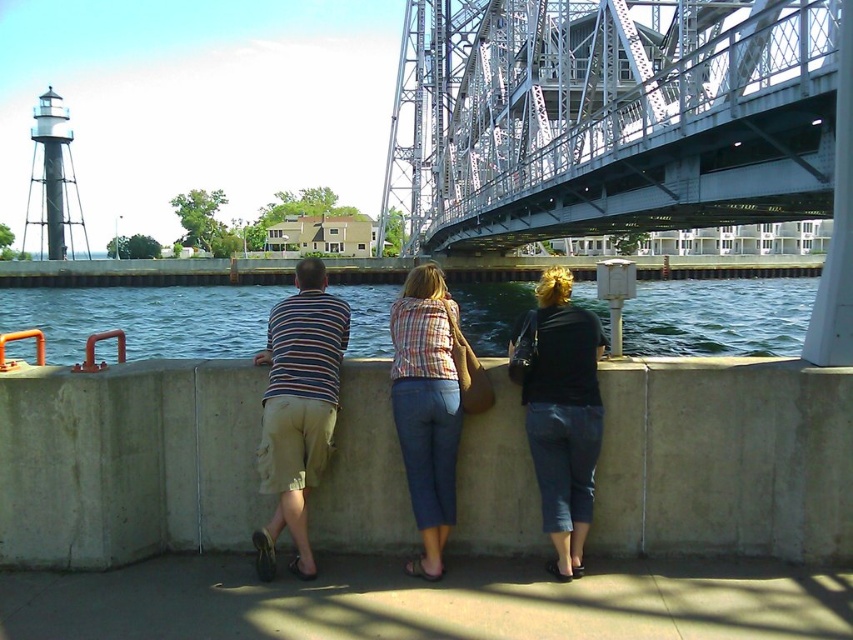
Question: Which point is closer to the camera taking this photo?

Choices:
 (A) (424, 358)
 (B) (560, 496)
 (C) (816, 44)

Answer: (B)

Question: Is black denim jeans at center positioned at the back of plaid shirt at center?

Choices:
 (A) yes
 (B) no

Answer: (B)

Question: Which object is closer to the camera taking this photo?

Choices:
 (A) blue water at center
 (B) plaid shirt at center

Answer: (B)

Question: Is striped cotton shirt at center above striped fabric shorts at center?

Choices:
 (A) no
 (B) yes

Answer: (B)

Question: Does blue water at center have a greater width compared to black denim jeans at center?

Choices:
 (A) yes
 (B) no

Answer: (A)

Question: Which point is farther from the camera taking this photo?

Choices:
 (A) (453, 493)
 (B) (440, 426)
 (C) (688, 70)
 (D) (70, 340)

Answer: (D)